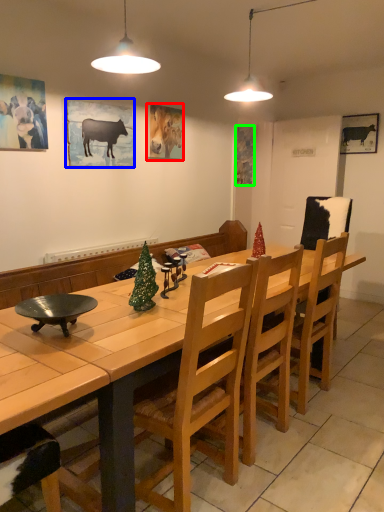
Question: Based on their relative distances, which object is nearer to picture frame (highlighted by a red box)? Choose from picture frame (highlighted by a blue box) and picture frame (highlighted by a green box).

Choices:
 (A) picture frame
 (B) picture frame

Answer: (A)